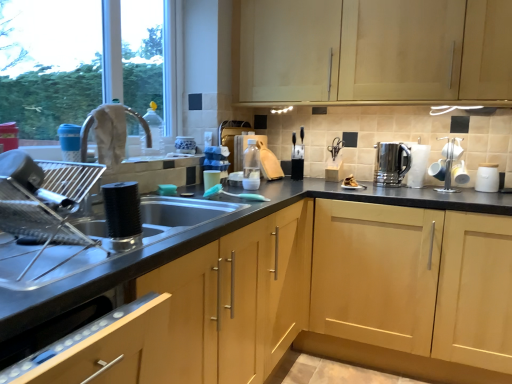
Question: Considering the relative sizes of transparent plastic bottle at upper center, the 2th bottle from the right, and stainless steel kettle at right in the image provided, is transparent plastic bottle at upper center, the 2th bottle from the right, thinner than stainless steel kettle at right?

Choices:
 (A) no
 (B) yes

Answer: (B)

Question: Is transparent plastic bottle at upper center, which is the first bottle from left to right, behind stainless steel kettle at right?

Choices:
 (A) yes
 (B) no

Answer: (B)

Question: Is transparent plastic bottle at upper center, which is counted as the 2th bottle, starting from the back, not close to stainless steel kettle at right?

Choices:
 (A) yes
 (B) no

Answer: (A)

Question: Does transparent plastic bottle at upper center, which is the first bottle from left to right, touch stainless steel kettle at right?

Choices:
 (A) yes
 (B) no

Answer: (B)

Question: Does transparent plastic bottle at upper center, which is the first bottle from left to right, have a greater width compared to stainless steel kettle at right?

Choices:
 (A) yes
 (B) no

Answer: (B)

Question: Choose the correct answer: Is white glossy mugs at right, the 2th appliance when ordered from front to back, inside light wood cabinet at upper center, which is counted as the third cabinetry, starting from the bottom, or outside it?

Choices:
 (A) outside
 (B) inside

Answer: (A)

Question: Considering their positions, is white glossy mugs at right, the 2th appliance when ordered from front to back, located in front of or behind light wood cabinet at upper center, which is counted as the third cabinetry, starting from the bottom?

Choices:
 (A) front
 (B) behind

Answer: (B)

Question: Is white glossy mugs at right, which is the 3th appliance in back-to-front order, to the left or to the right of light wood cabinet at upper center, which is counted as the third cabinetry, starting from the bottom, in the image?

Choices:
 (A) left
 (B) right

Answer: (B)

Question: Is point (460, 139) closer or farther from the camera than point (448, 4)?

Choices:
 (A) closer
 (B) farther

Answer: (B)

Question: From the image's perspective, is white matte jar at right, which is the second appliance from back to front, located above or below light wood cabinet at upper center, which is counted as the third cabinetry, starting from the bottom?

Choices:
 (A) below
 (B) above

Answer: (A)

Question: In terms of width, does white matte jar at right, which is the second appliance from back to front, look wider or thinner when compared to light wood cabinet at upper center, the 1th cabinetry when ordered from top to bottom?

Choices:
 (A) thin
 (B) wide

Answer: (A)

Question: In terms of height, does white matte jar at right, the third appliance viewed from the front, look taller or shorter compared to light wood cabinet at upper center, the 1th cabinetry when ordered from top to bottom?

Choices:
 (A) tall
 (B) short

Answer: (B)

Question: Is white matte jar at right, the first appliance in the right-to-left sequence, in front of or behind light wood cabinet at upper center, which is counted as the third cabinetry, starting from the bottom, in the image?

Choices:
 (A) behind
 (B) front

Answer: (A)

Question: Which is correct: matte plastic cup at sink, the 1th appliance positioned from the left, is inside stainless steel kettle at right, or outside of it?

Choices:
 (A) inside
 (B) outside

Answer: (B)

Question: From a real-world perspective, relative to stainless steel kettle at right, is matte plastic cup at sink, the 1th appliance positioned from the left, vertically above or below?

Choices:
 (A) above
 (B) below

Answer: (B)